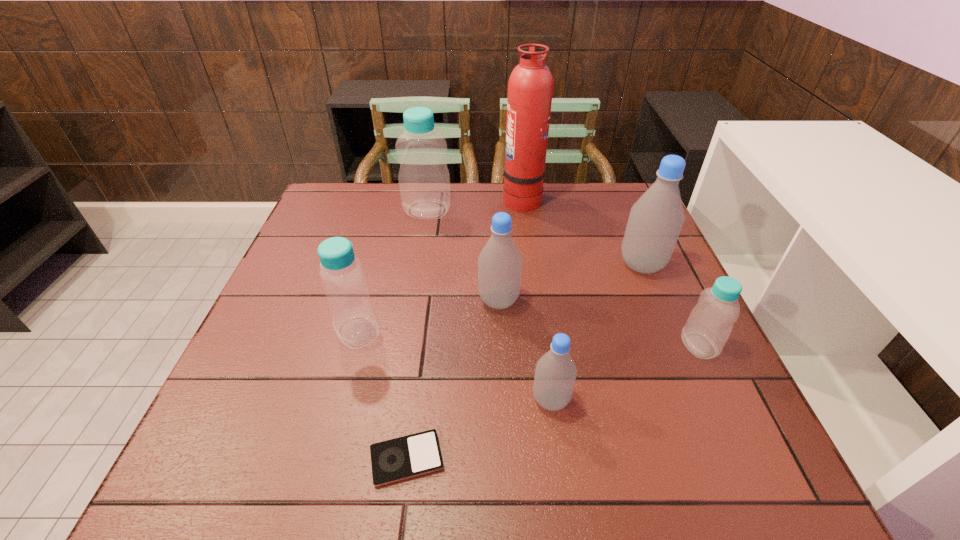
At what (x,y) coordinates should I click in order to perform the action: click on vacant space at the far right corner. Please return your answer as a coordinate pair (x, y). The width and height of the screenshot is (960, 540). Looking at the image, I should click on (623, 221).

In order to click on free space between the fire extinguisher and the third farthest object in this screenshot , I will do `click(582, 231)`.

Find the location of a particular element. free space between the smallest blue bottle and the second smallest gray bottle is located at coordinates (599, 323).

Locate an element on the screen. The image size is (960, 540). vacant area that lies between the rightmost blue bottle and the tallest object is located at coordinates (611, 272).

Where is `free space between the gray iPod and the second smallest gray bottle`? The height and width of the screenshot is (540, 960). free space between the gray iPod and the second smallest gray bottle is located at coordinates (453, 380).

Identify the location of free space between the second gray bottle from left to right and the farthest gray bottle. (596, 332).

Where is `unoccupied position between the fire extinguisher and the biggest blue bottle`? The image size is (960, 540). unoccupied position between the fire extinguisher and the biggest blue bottle is located at coordinates (474, 204).

I want to click on free area in between the second nearest object and the shortest object, so click(x=479, y=429).

In order to click on vacant area between the fire extinguisher and the iPod in this screenshot , I will do [465, 328].

Where is `free space between the sixth nearest object and the second farthest gray bottle`? The height and width of the screenshot is (540, 960). free space between the sixth nearest object and the second farthest gray bottle is located at coordinates (570, 282).